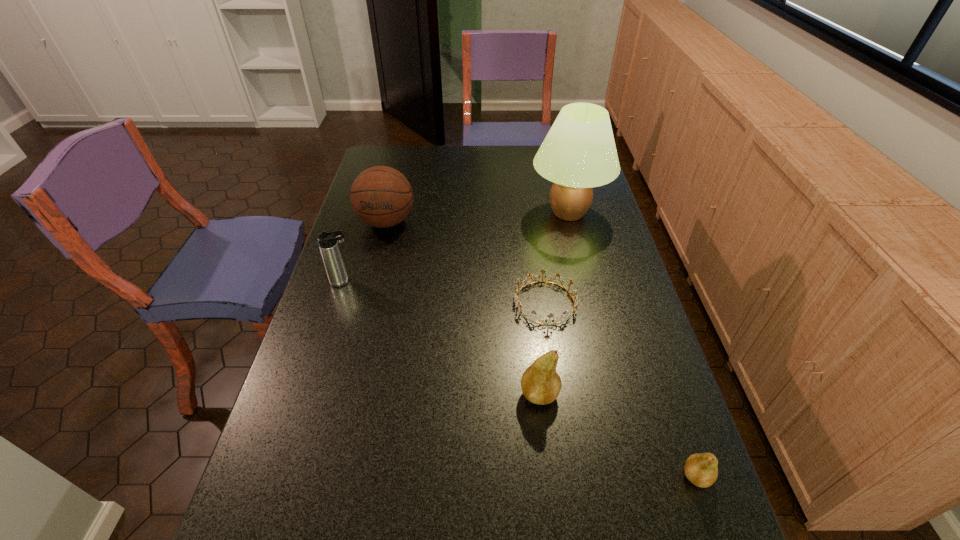
Locate an element on the screen. The height and width of the screenshot is (540, 960). free space located 0.160m on the shade of the tallest object is located at coordinates (484, 213).

What are the coordinates of `vacant area located on the shade of the tallest object` in the screenshot? It's located at (448, 213).

This screenshot has width=960, height=540. Find the location of `vacant space located on the shade of the tallest object`. vacant space located on the shade of the tallest object is located at coordinates (498, 213).

You are a GUI agent. You are given a task and a screenshot of the screen. Output one action in this format:
    pyautogui.click(x=<x>, y=<y>)
    Task: Click on the free spot located 0.060m on the side with brand label of the basketball
    The image size is (960, 540).
    Given the screenshot: What is the action you would take?
    point(379,252)

The image size is (960, 540). In order to click on free space located on the front-facing side of the tiara in this screenshot , I will do `click(554, 364)`.

Find the location of `vacant space located on the handle side of the thermos bottle`. vacant space located on the handle side of the thermos bottle is located at coordinates (457, 281).

What are the coordinates of `object present at the near edge` in the screenshot? It's located at (701, 469).

This screenshot has height=540, width=960. I want to click on basketball that is at the left edge, so click(381, 196).

At what (x,y) coordinates should I click in order to perform the action: click on thermos bottle that is at the left edge. Please return your answer as a coordinate pair (x, y). The width and height of the screenshot is (960, 540). Looking at the image, I should click on (328, 241).

The image size is (960, 540). I want to click on pear that is at the right edge, so click(x=701, y=469).